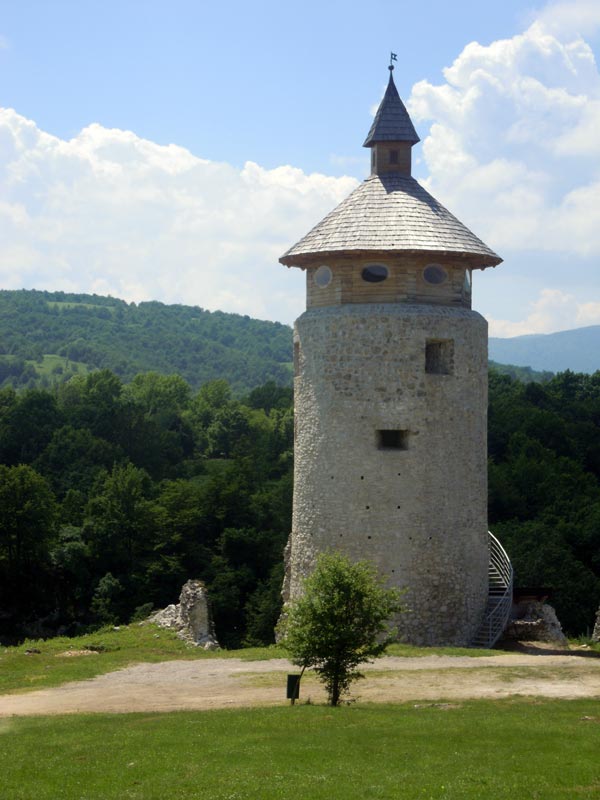
You are a GUI agent. You are given a task and a screenshot of the screen. Output one action in this format:
    pyautogui.click(x=<x>, y=<y>)
    Task: Click on the staircase railing
    
    Given the screenshot: What is the action you would take?
    pyautogui.click(x=492, y=614), pyautogui.click(x=507, y=574), pyautogui.click(x=501, y=542), pyautogui.click(x=503, y=558)